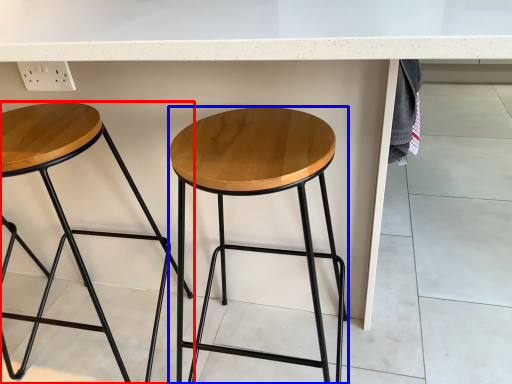
Question: Which object appears farthest to the camera in this image, stool (highlighted by a red box) or stool (highlighted by a blue box)?

Choices:
 (A) stool
 (B) stool

Answer: (A)